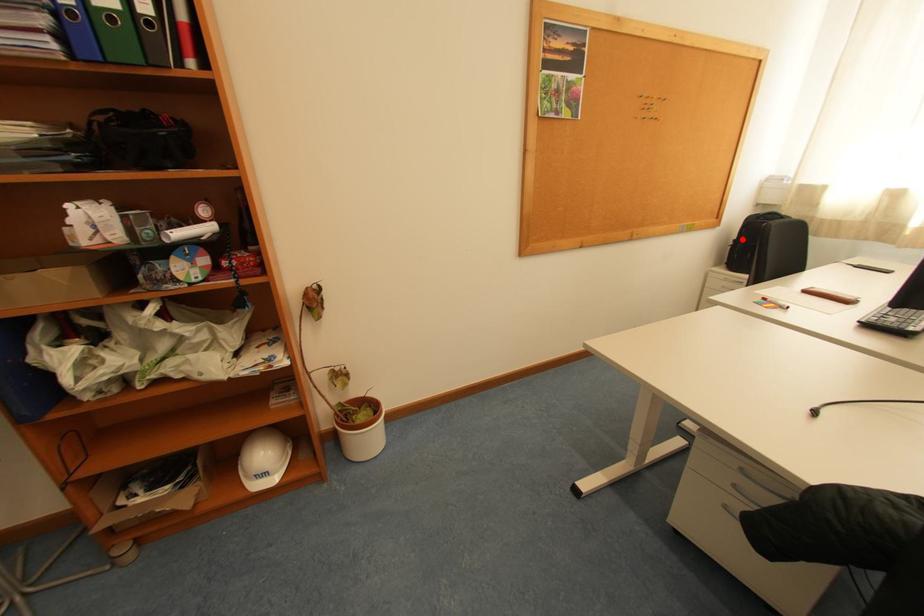
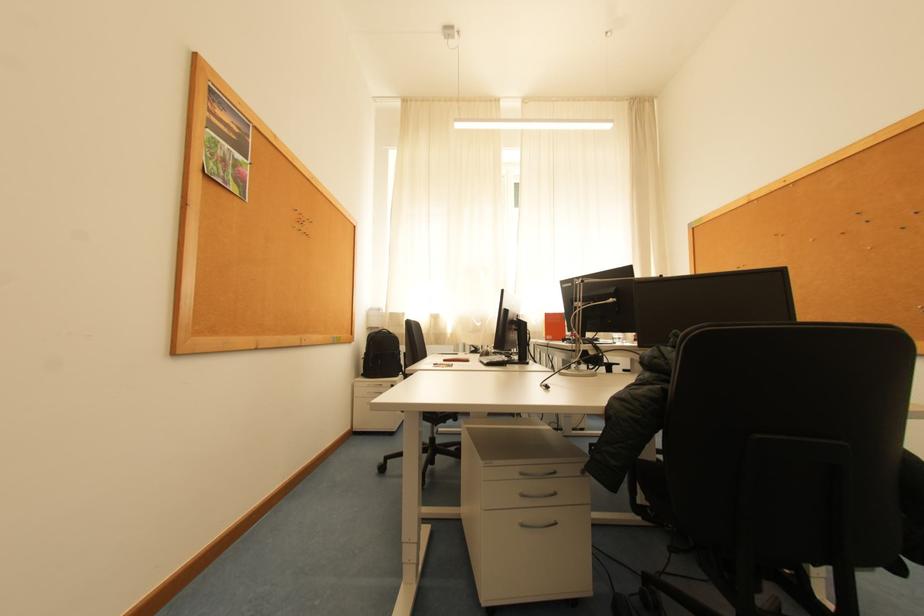
Where in the second image is the point corresponding to the highlighted location from the first image?

(372, 353)